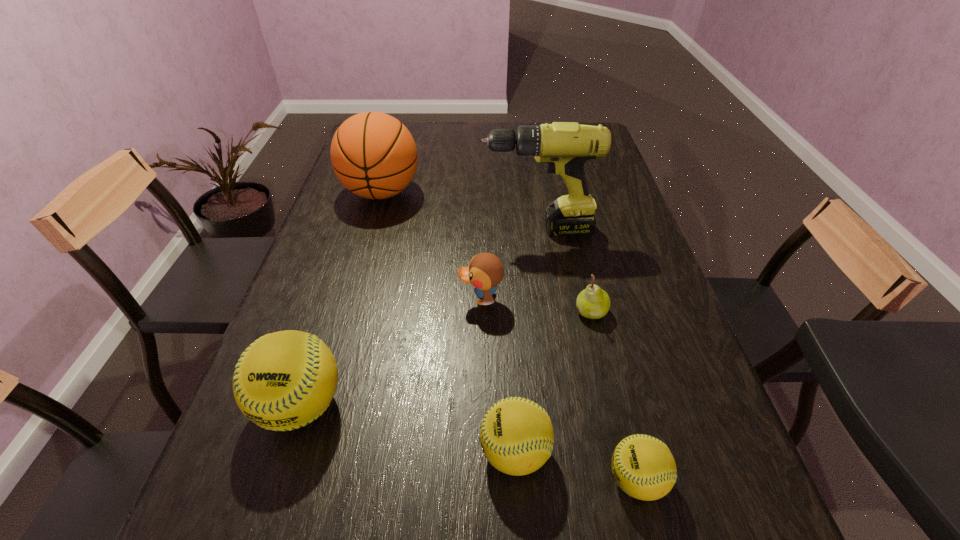
What are the coordinates of `duck` in the screenshot? It's located at (485, 271).

You are a GUI agent. You are given a task and a screenshot of the screen. Output one action in this format:
    pyautogui.click(x=<x>, y=<y>)
    Task: Click on the free space located 0.050m on the logo side of the third tallest object
    The image size is (960, 540).
    Given the screenshot: What is the action you would take?
    pyautogui.click(x=277, y=476)

This screenshot has width=960, height=540. I want to click on blank space located on the logo side of the second softball from left to right, so click(368, 452).

You are a GUI agent. You are given a task and a screenshot of the screen. Output one action in this format:
    pyautogui.click(x=<x>, y=<y>)
    Task: Click on the vacant space located on the logo side of the second softball from left to right
    Image resolution: width=960 pixels, height=540 pixels.
    Given the screenshot: What is the action you would take?
    pyautogui.click(x=407, y=452)

Identify the location of vacant area located on the logo side of the second softball from left to right. The height and width of the screenshot is (540, 960). (290, 452).

At what (x,y) coordinates should I click in order to perform the action: click on vacant space located on the logo side of the shortest softball. Please return your answer as a coordinate pair (x, y). The height and width of the screenshot is (540, 960). Looking at the image, I should click on (479, 479).

Locate an element on the screen. The height and width of the screenshot is (540, 960). vacant space located 0.120m on the logo side of the shortest softball is located at coordinates (537, 479).

At what (x,y) coordinates should I click in order to perform the action: click on free space located on the logo side of the shortest softball. Please return your answer as a coordinate pair (x, y). Image resolution: width=960 pixels, height=540 pixels. Looking at the image, I should click on click(438, 479).

Where is `free location located 0.260m on the back of the pear`? free location located 0.260m on the back of the pear is located at coordinates (572, 233).

This screenshot has width=960, height=540. Find the location of `free location located 0.070m on the front of the basketball`. free location located 0.070m on the front of the basketball is located at coordinates (371, 231).